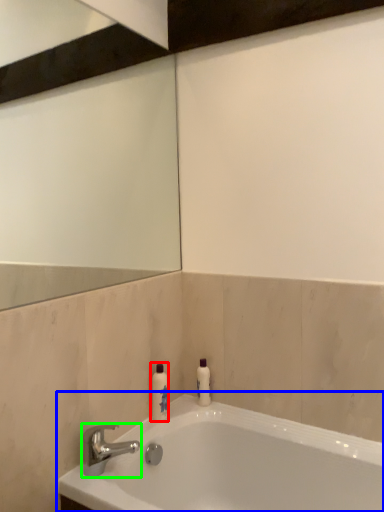
Question: Estimate the real-world distances between objects in this image. Which object is closer to toiletry (highlighted by a red box), bathtub (highlighted by a blue box) or tap (highlighted by a green box)?

Choices:
 (A) bathtub
 (B) tap

Answer: (B)